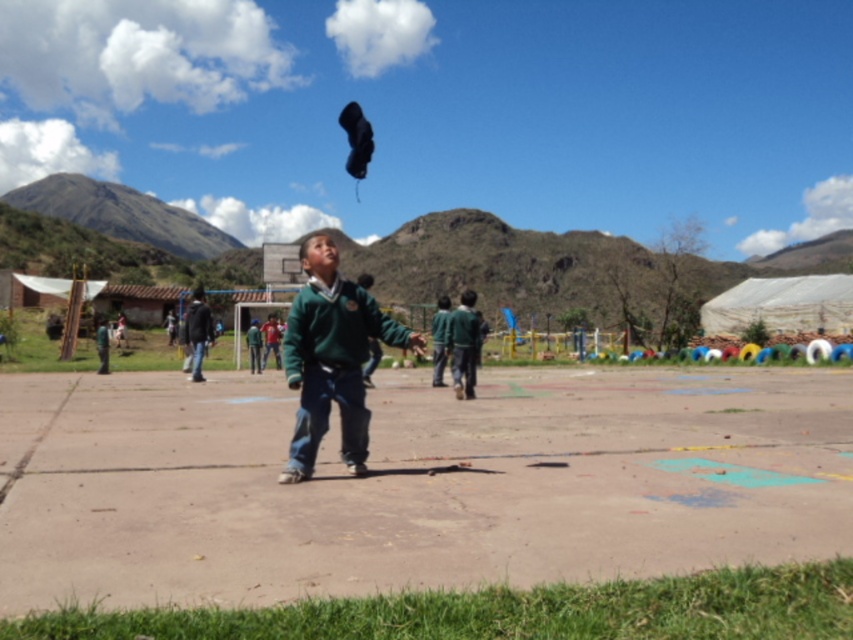
Question: Which is nearer to the green matte sweater at center?

Choices:
 (A) dark gray hoodie at left
 (B) green matte uniform at center

Answer: (B)

Question: Which object appears closest to the camera in this image?

Choices:
 (A) dark gray hoodie at left
 (B) green matte sweater at center
 (C) green matte uniform at center

Answer: (B)

Question: Which point is farther to the camera?

Choices:
 (A) (194, 307)
 (B) (347, 355)

Answer: (A)

Question: Does green matte sweater at center appear under dark gray hoodie at left?

Choices:
 (A) yes
 (B) no

Answer: (A)

Question: Considering the relative positions of green matte sweater at center and dark gray hoodie at left in the image provided, where is green matte sweater at center located with respect to dark gray hoodie at left?

Choices:
 (A) right
 (B) left

Answer: (A)

Question: Is green matte uniform at center positioned before dark gray hoodie at left?

Choices:
 (A) yes
 (B) no

Answer: (A)